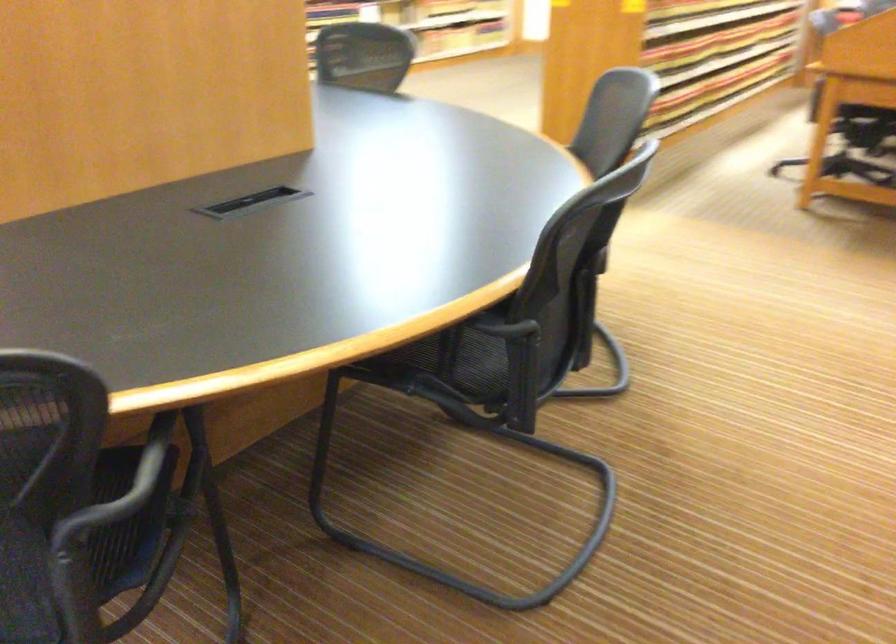
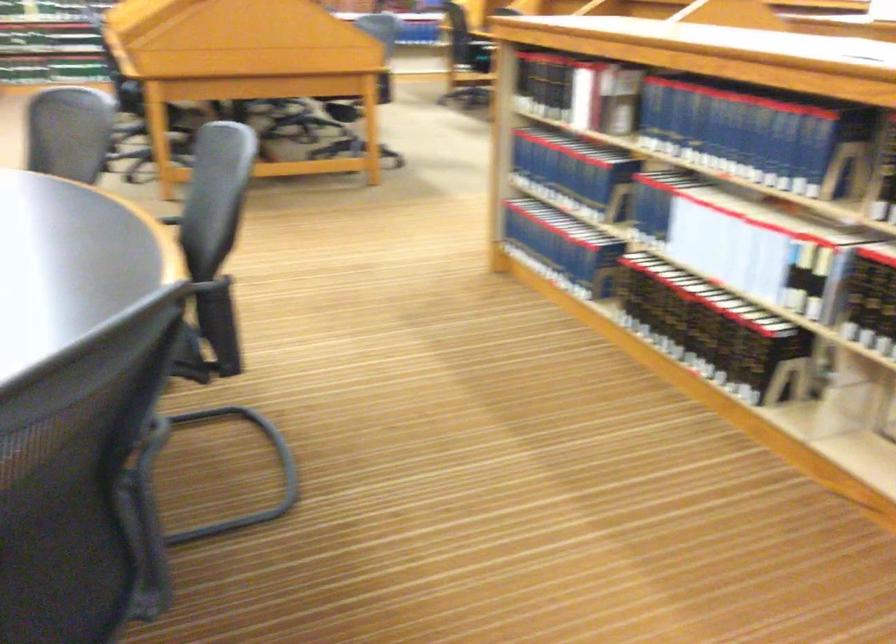
Question: How did the camera likely rotate?

Choices:
 (A) Left
 (B) Right
 (C) Up
 (D) Down

Answer: (B)